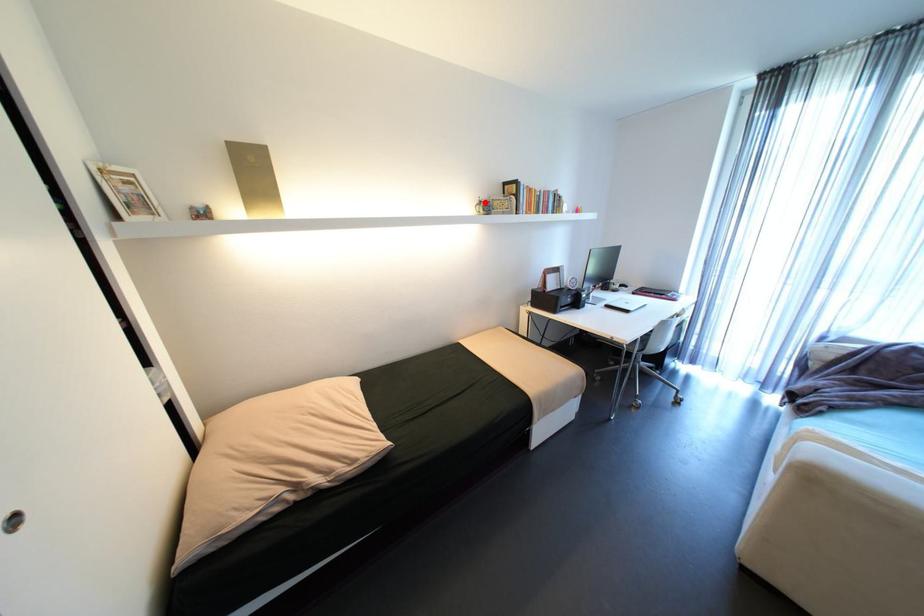
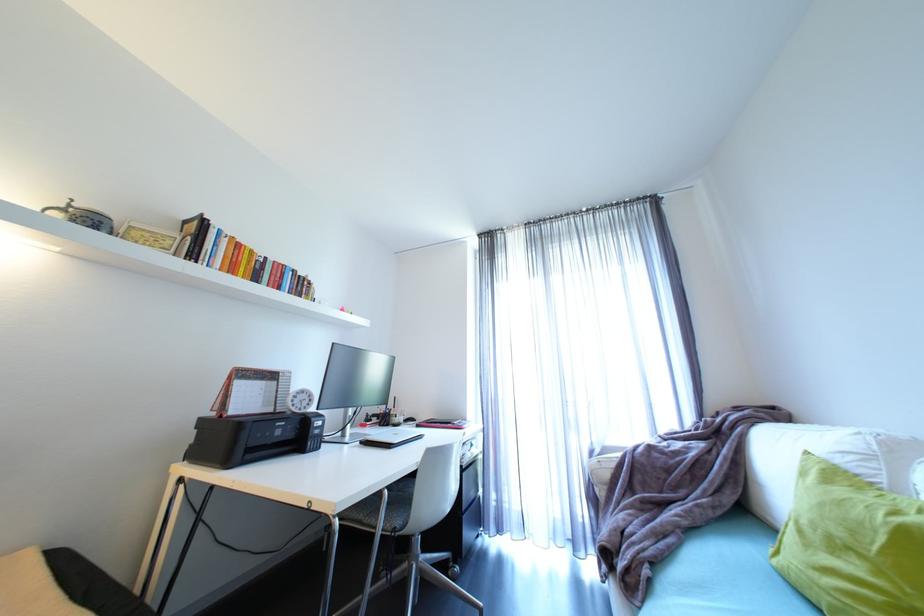
Question: I am providing you with two images of the same scene from different viewpoints. A red point is marked on the first image. At the location where the point appears in image 1, is it still visible in image 2?

Choices:
 (A) Yes
 (B) No

Answer: (A)